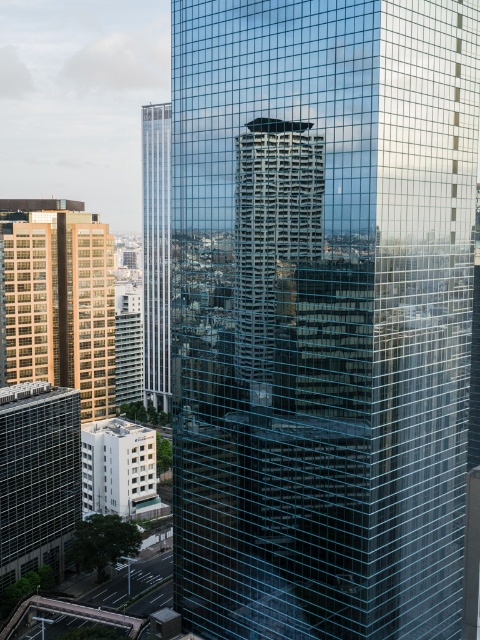
Question: Considering the real-world distances, which object is farthest from the matte glass building at lower left?

Choices:
 (A) transparent glass skyscraper at center
 (B) reflective glass tower at center
 (C) clear glass skyscraper at center

Answer: (C)

Question: Is transparent glass skyscraper at center positioned before matte glass building at lower left?

Choices:
 (A) no
 (B) yes

Answer: (B)

Question: Which point is farther from the camera taking this photo?

Choices:
 (A) (148, 280)
 (B) (37, 408)
 (C) (12, 289)

Answer: (A)

Question: Observing the image, what is the correct spatial positioning of reflective glass tower at center in reference to clear glass skyscraper at center?

Choices:
 (A) above
 (B) below

Answer: (B)

Question: Is reflective glass tower at center above clear glass skyscraper at center?

Choices:
 (A) yes
 (B) no

Answer: (B)

Question: Estimate the real-world distances between objects in this image. Which object is farther from the clear glass skyscraper at center?

Choices:
 (A) golden glass building at left
 (B) reflective glass tower at center
 (C) transparent glass skyscraper at center
 (D) matte glass building at lower left

Answer: (B)